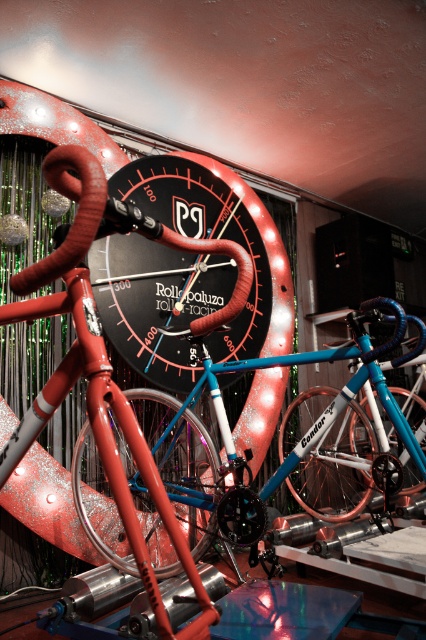
Question: Which point is closer to the camera taking this photo?

Choices:
 (A) (198, 310)
 (B) (284, 456)

Answer: (A)

Question: Which point appears farthest from the camera in this image?

Choices:
 (A) (245, 189)
 (B) (360, 502)

Answer: (A)

Question: Is shiny blue frame bicycle at center to the left of metallic black clock at center from the viewer's perspective?

Choices:
 (A) no
 (B) yes

Answer: (A)

Question: Does shiny blue frame bicycle at center have a lesser width compared to metallic black clock at center?

Choices:
 (A) yes
 (B) no

Answer: (B)

Question: Is shiny blue frame bicycle at center positioned in front of metallic black clock at center?

Choices:
 (A) no
 (B) yes

Answer: (B)